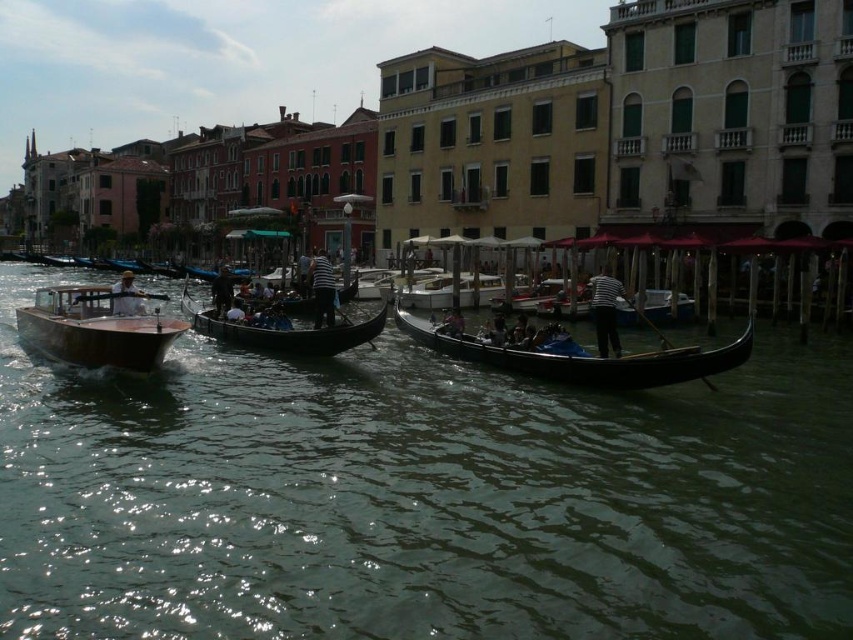
Question: Does clear water at boat right appear on the left side of striped fabric person at center?

Choices:
 (A) no
 (B) yes

Answer: (A)

Question: Is black polished gondola at center to the left of striped fabric person at center from the viewer's perspective?

Choices:
 (A) no
 (B) yes

Answer: (A)

Question: Estimate the real-world distances between objects in this image. Which object is farther from the striped fabric shirt at center?

Choices:
 (A) striped fabric person at center
 (B) wooden boat at left
 (C) matte brown boat at left
 (D) black polished gondola at center

Answer: (C)

Question: Which point is farther from the camera taking this photo?

Choices:
 (A) (218, 282)
 (B) (343, 340)
 (C) (590, 298)

Answer: (C)

Question: Which object is positioned closest to the clear water at boat right?

Choices:
 (A) matte brown boat at left
 (B) wooden boat at left
 (C) striped fabric shirt at center

Answer: (B)

Question: Can you confirm if matte brown boat at left is wider than dark blue fabric at center?

Choices:
 (A) no
 (B) yes

Answer: (B)